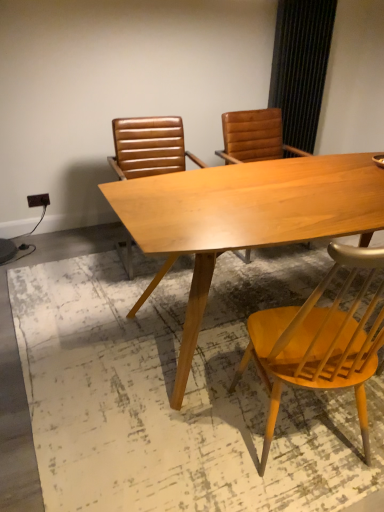
This screenshot has width=384, height=512. What do you see at coordinates (319, 342) in the screenshot?
I see `light wood chair at lower right, which appears as the second chair when viewed from the left` at bounding box center [319, 342].

Locate an element on the screen. light wood table at center is located at coordinates (244, 218).

What are the coordinates of `leather-like brown chair at center, the 1th chair from the left` in the screenshot? It's located at (149, 147).

The width and height of the screenshot is (384, 512). What are the coordinates of `light wood chair at lower right, which is the 1th chair in right-to-left order` in the screenshot? It's located at [319, 342].

Between point (173, 147) and point (362, 358), which one is positioned behind?

The point (173, 147) is farther from the camera.

Which of these two, leather-like brown chair at center, which ranks as the first chair in back-to-front order, or light wood chair at lower right, which is the 1th chair in right-to-left order, stands taller?

light wood chair at lower right, which is the 1th chair in right-to-left order, is taller.

In terms of width, does leather-like brown chair at center, the 1th chair from the left, look wider or thinner when compared to light wood chair at lower right, the first chair when ordered from front to back?

Clearly, leather-like brown chair at center, the 1th chair from the left, has more width compared to light wood chair at lower right, the first chair when ordered from front to back.

Based on the photo, from the image's perspective, which is below, leather-like brown chair at center, which ranks as the first chair in back-to-front order, or light wood chair at lower right, marked as the second chair in a back-to-front arrangement?

light wood chair at lower right, marked as the second chair in a back-to-front arrangement, appears lower in the image.

Considering the sizes of objects light wood table at center and light wood chair at lower right, which is the 1th chair in right-to-left order, in the image provided, who is thinner, light wood table at center or light wood chair at lower right, which is the 1th chair in right-to-left order,?

With smaller width is light wood chair at lower right, which is the 1th chair in right-to-left order.

Is light wood table at center not close to light wood chair at lower right, the first chair when ordered from front to back?

No, there isn't a large distance between light wood table at center and light wood chair at lower right, the first chair when ordered from front to back.

From the image's perspective, is light wood table at center on top of light wood chair at lower right, marked as the second chair in a back-to-front arrangement?

Yes, from the image's perspective, light wood table at center is on top of light wood chair at lower right, marked as the second chair in a back-to-front arrangement.

Which object is further away from the camera taking this photo, light wood table at center or light wood chair at lower right, which appears as the second chair when viewed from the left?

light wood table at center is behind.

From a real-world perspective, is light wood chair at lower right, which appears as the second chair when viewed from the left, located higher than leather-like brown chair at center, which is the second chair from right to left?

Indeed, from a real-world perspective, light wood chair at lower right, which appears as the second chair when viewed from the left, stands above leather-like brown chair at center, which is the second chair from right to left.

Which object is wider, light wood chair at lower right, which appears as the second chair when viewed from the left, or leather-like brown chair at center, which is the second chair from right to left?

leather-like brown chair at center, which is the second chair from right to left, is wider.

In the image, is light wood chair at lower right, which is the 1th chair in right-to-left order, positioned in front of or behind leather-like brown chair at center, the 1th chair from the left?

Clearly, light wood chair at lower right, which is the 1th chair in right-to-left order, is in front of leather-like brown chair at center, the 1th chair from the left.

Considering the positions of points (375, 303) and (130, 257), is point (375, 303) farther from camera compared to point (130, 257)?

No, it is in front of (130, 257).

Is light wood table at center located within light wood chair at lower right, marked as the second chair in a back-to-front arrangement?

That's incorrect, light wood table at center is not inside light wood chair at lower right, marked as the second chair in a back-to-front arrangement.

Can you see light wood chair at lower right, which appears as the second chair when viewed from the left, touching light wood table at center?

light wood chair at lower right, which appears as the second chair when viewed from the left, and light wood table at center are not in contact.

This screenshot has height=512, width=384. I want to click on table behind the light wood chair at lower right, marked as the second chair in a back-to-front arrangement, so click(x=244, y=218).

Is light wood chair at lower right, which is the 1th chair in right-to-left order, wider than light wood table at center?

No, light wood chair at lower right, which is the 1th chair in right-to-left order, is not wider than light wood table at center.

From a real-world perspective, who is located lower, light wood table at center or leather-like brown chair at center, which ranks as the first chair in back-to-front order?

From a 3D spatial view, light wood table at center is below.

Is light wood table at center positioned before leather-like brown chair at center, which is the second chair from right to left?

That is True.

Considering the sizes of objects light wood table at center and leather-like brown chair at center, which ranks as the first chair in back-to-front order, in the image provided, who is bigger, light wood table at center or leather-like brown chair at center, which ranks as the first chair in back-to-front order,?

Bigger between the two is light wood table at center.

In terms of height, does light wood table at center look taller or shorter compared to leather-like brown chair at center, the 1th chair from the left?

Considering their sizes, light wood table at center has less height than leather-like brown chair at center, the 1th chair from the left.

Is point (167, 146) positioned behind point (181, 223)?

That is True.

Is leather-like brown chair at center, which ranks as the first chair in back-to-front order, smaller than light wood table at center?

Yes, leather-like brown chair at center, which ranks as the first chair in back-to-front order, is smaller than light wood table at center.

Can you confirm if leather-like brown chair at center, the 1th chair from the left, is wider than light wood table at center?

Incorrect, the width of leather-like brown chair at center, the 1th chair from the left, does not surpass that of light wood table at center.

Locate an element on the screen. The height and width of the screenshot is (512, 384). chair that is below the leather-like brown chair at center, which ranks as the 2th chair in front-to-back order (from the image's perspective) is located at coordinates (319, 342).

Find the location of a particular element. The height and width of the screenshot is (512, 384). table above the light wood chair at lower right, the first chair when ordered from front to back (from the image's perspective) is located at coordinates (244, 218).

Considering their positions, is light wood chair at lower right, marked as the second chair in a back-to-front arrangement, positioned further to leather-like brown chair at center, which ranks as the first chair in back-to-front order, than light wood table at center?

light wood chair at lower right, marked as the second chair in a back-to-front arrangement, is further to leather-like brown chair at center, which ranks as the first chair in back-to-front order.

From the image, which object appears to be farther from leather-like brown chair at center, which ranks as the first chair in back-to-front order, light wood table at center or light wood chair at lower right, which is the 1th chair in right-to-left order?

The object further to leather-like brown chair at center, which ranks as the first chair in back-to-front order, is light wood chair at lower right, which is the 1th chair in right-to-left order.

Estimate the real-world distances between objects in this image. Which object is closer to light wood chair at lower right, marked as the second chair in a back-to-front arrangement, light wood table at center or leather-like brown chair at center, which ranks as the first chair in back-to-front order?

light wood table at center is positioned closer to the anchor light wood chair at lower right, marked as the second chair in a back-to-front arrangement.

From the image, which object appears to be nearer to light wood table at center, leather-like brown chair at center, the 1th chair from the left, or light wood chair at lower right, which is the 1th chair in right-to-left order?

Among the two, light wood chair at lower right, which is the 1th chair in right-to-left order, is located nearer to light wood table at center.

Considering their positions, is light wood chair at lower right, marked as the second chair in a back-to-front arrangement, positioned closer to light wood table at center than leather-like brown chair at center, which ranks as the first chair in back-to-front order?

Among the two, light wood chair at lower right, marked as the second chair in a back-to-front arrangement, is located nearer to light wood table at center.

Considering their positions, is leather-like brown chair at center, the 1th chair from the left, positioned closer to light wood chair at lower right, which is the 1th chair in right-to-left order, than light wood table at center?

light wood table at center.

This screenshot has width=384, height=512. I want to click on table located between light wood chair at lower right, marked as the second chair in a back-to-front arrangement, and leather-like brown chair at center, which ranks as the first chair in back-to-front order, in the depth direction, so click(x=244, y=218).